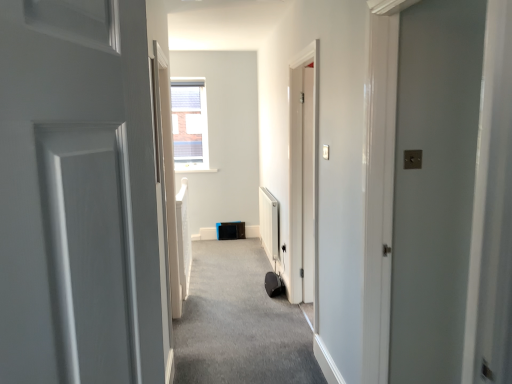
Question: From the image's perspective, is carpeted carpet at center located above or below white glossy door at right?

Choices:
 (A) below
 (B) above

Answer: (A)

Question: In terms of width, does carpeted carpet at center look wider or thinner when compared to white glossy door at right?

Choices:
 (A) wide
 (B) thin

Answer: (A)

Question: Is carpeted carpet at center taller or shorter than white glossy door at right?

Choices:
 (A) short
 (B) tall

Answer: (A)

Question: Do you think white glossy door at right is within carpeted carpet at center, or outside of it?

Choices:
 (A) inside
 (B) outside

Answer: (B)

Question: In terms of width, does white glossy door at right look wider or thinner when compared to carpeted carpet at center?

Choices:
 (A) thin
 (B) wide

Answer: (A)

Question: Based on their sizes in the image, would you say white glossy door at right is bigger or smaller than carpeted carpet at center?

Choices:
 (A) small
 (B) big

Answer: (B)

Question: Relative to carpeted carpet at center, is white glossy door at right in front or behind?

Choices:
 (A) behind
 (B) front

Answer: (B)